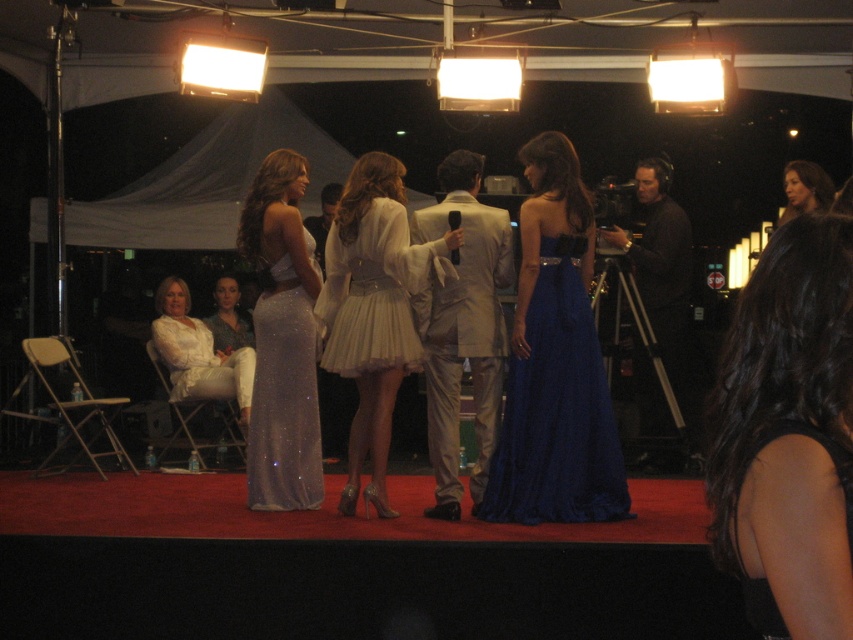
Question: Among these points, which one is nearest to the camera?

Choices:
 (A) (647, 282)
 (B) (383, 307)
 (C) (805, 186)

Answer: (B)

Question: Is blue satin gown at center positioned at the back of black matte camera at right?

Choices:
 (A) yes
 (B) no

Answer: (B)

Question: Which object is positioned closest to the white satin dress at left?

Choices:
 (A) satin blue dress at center
 (B) shiny silver dress at upper right
 (C) white satin dress at center
 (D) sparkly silver dress at center

Answer: (D)

Question: Is satin beige suit at center thinner than shiny silver dress at upper right?

Choices:
 (A) no
 (B) yes

Answer: (A)

Question: Estimate the real-world distances between objects in this image. Which object is farther from the black matte camera at right?

Choices:
 (A) matte white dress at center
 (B) white satin dress at left

Answer: (A)

Question: Is white satin dress at left to the right of shiny silver dress at upper right from the viewer's perspective?

Choices:
 (A) yes
 (B) no

Answer: (B)